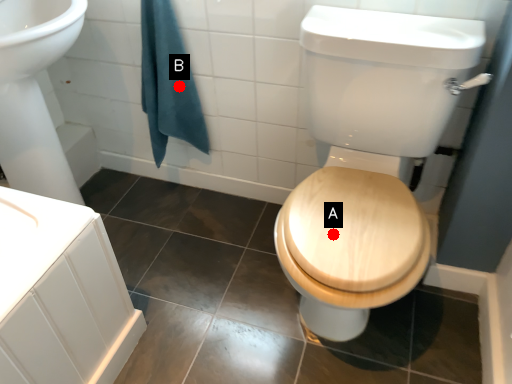
Question: Two points are circled on the image, labeled by A and B beside each circle. Which point is closer to the camera?

Choices:
 (A) A is closer
 (B) B is closer

Answer: (A)